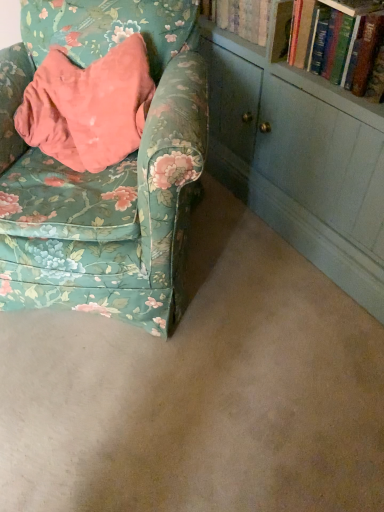
Question: Can you confirm if hardcover book at upper right is wider than floral fabric chair at left?

Choices:
 (A) no
 (B) yes

Answer: (A)

Question: From a real-world perspective, is hardcover book at upper right on top of floral fabric chair at left?

Choices:
 (A) yes
 (B) no

Answer: (A)

Question: Is hardcover book at upper right positioned in front of floral fabric chair at left?

Choices:
 (A) no
 (B) yes

Answer: (A)

Question: Is hardcover book at upper right to the right of floral fabric chair at left from the viewer's perspective?

Choices:
 (A) no
 (B) yes

Answer: (B)

Question: Can you confirm if hardcover book at upper right is bigger than floral fabric chair at left?

Choices:
 (A) yes
 (B) no

Answer: (B)

Question: Is floral fabric chair at left completely or partially inside hardcover book at upper right?

Choices:
 (A) no
 (B) yes

Answer: (A)

Question: From the image's perspective, is floral fabric chair at left on hardcover book at upper right?

Choices:
 (A) yes
 (B) no

Answer: (B)

Question: Can you confirm if floral fabric chair at left is bigger than hardcover book at upper right?

Choices:
 (A) no
 (B) yes

Answer: (B)

Question: Is hardcover book at upper right completely or partially inside floral fabric chair at left?

Choices:
 (A) yes
 (B) no

Answer: (B)

Question: From a real-world perspective, is floral fabric chair at left on hardcover book at upper right?

Choices:
 (A) no
 (B) yes

Answer: (A)

Question: Can you confirm if floral fabric chair at left is wider than hardcover book at upper right?

Choices:
 (A) no
 (B) yes

Answer: (B)

Question: Does floral fabric chair at left appear on the left side of hardcover book at upper right?

Choices:
 (A) no
 (B) yes

Answer: (B)

Question: From a real-world perspective, is hardcover book at upper right positioned above or below floral fabric chair at left?

Choices:
 (A) above
 (B) below

Answer: (A)